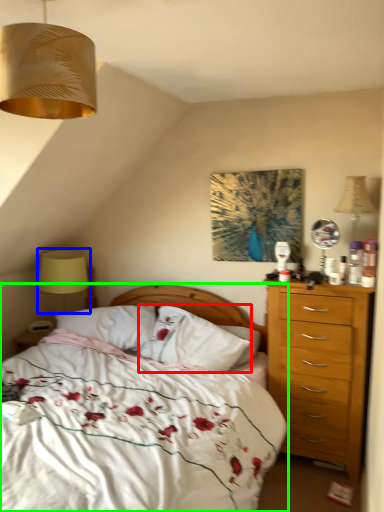
Question: Which object is positioned farthest from pillow (highlighted by a red box)? Select from table lamp (highlighted by a blue box) and bed (highlighted by a green box).

Choices:
 (A) table lamp
 (B) bed

Answer: (A)